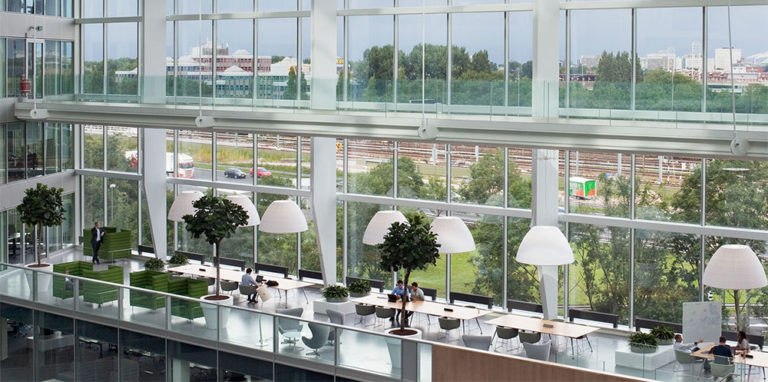
Identify the location of lamp shade. (742, 279), (558, 250), (464, 238), (382, 221), (283, 218), (243, 204), (180, 201).